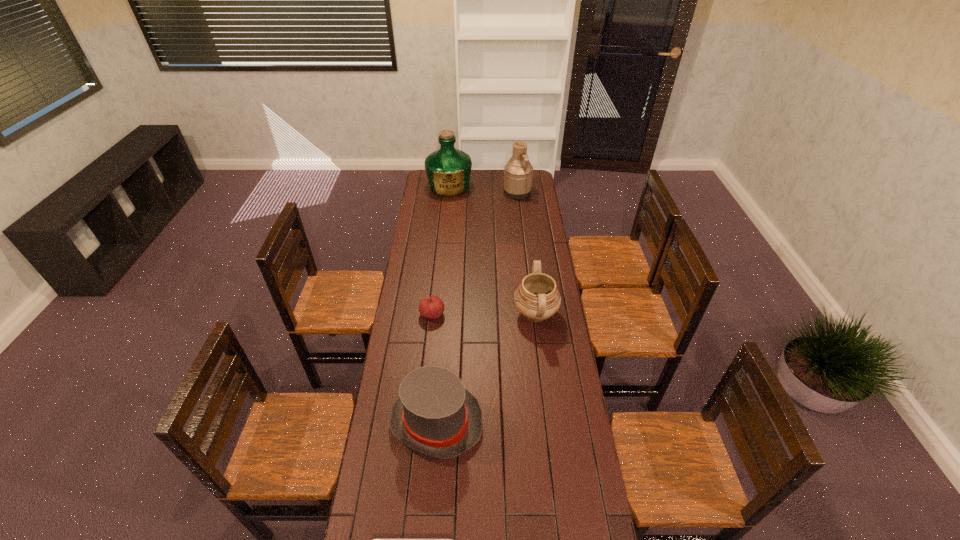
Identify the location of object positioned at the far right corner. (518, 173).

Locate an element on the screen. vacant region at the far edge is located at coordinates (479, 173).

In the image, there is a desktop. Identify the location of vacant space at the left edge. The image size is (960, 540). (440, 220).

Locate an element on the screen. Image resolution: width=960 pixels, height=540 pixels. free space at the right edge is located at coordinates (530, 332).

This screenshot has width=960, height=540. I want to click on vacant region between the pitcher and the tomato, so [475, 253].

The height and width of the screenshot is (540, 960). I want to click on blank region between the urn and the pitcher, so click(x=526, y=253).

Identify the location of free space between the fifth farthest object and the pitcher. Image resolution: width=960 pixels, height=540 pixels. (477, 307).

The height and width of the screenshot is (540, 960). Identify the location of vacant space that is in between the pitcher and the fifth tallest object. (475, 253).

This screenshot has width=960, height=540. In order to click on vacant area that lies between the urn and the liquor in this screenshot , I will do `click(492, 250)`.

Where is `free space between the fifth tallest object and the pitcher`? This screenshot has height=540, width=960. free space between the fifth tallest object and the pitcher is located at coordinates (475, 253).